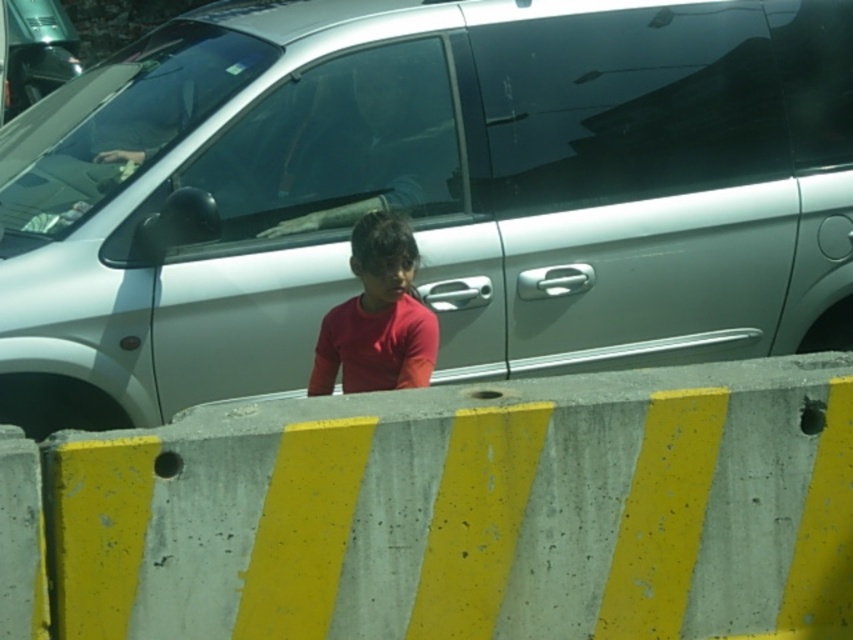
Is silver metallic car at center below concrete/yellow striped barrier at center?

No, silver metallic car at center is not below concrete/yellow striped barrier at center.

Is point (396, 86) farther from viewer compared to point (817, 540)?

That is True.

This screenshot has width=853, height=640. What do you see at coordinates (426, 193) in the screenshot? I see `silver metallic car at center` at bounding box center [426, 193].

Identify the location of silver metallic car at center. The width and height of the screenshot is (853, 640). (426, 193).

Image resolution: width=853 pixels, height=640 pixels. What do you see at coordinates (450, 513) in the screenshot? I see `concrete/yellow striped barrier at center` at bounding box center [450, 513].

In the scene shown: How much distance is there between concrete/yellow striped barrier at center and red matte shirt at center?

1.07 meters

Describe the element at coordinates (450, 513) in the screenshot. I see `concrete/yellow striped barrier at center` at that location.

Locate an element on the screen. The height and width of the screenshot is (640, 853). concrete/yellow striped barrier at center is located at coordinates (450, 513).

Who is positioned more to the left, silver metallic car at center or red matte shirt at center?

Positioned to the left is red matte shirt at center.

Can you confirm if silver metallic car at center is positioned below red matte shirt at center?

No.

Does point (643, 84) lie in front of point (430, 372)?

No, (643, 84) is further to viewer.

Find the location of a particular element. Image resolution: width=853 pixels, height=640 pixels. silver metallic car at center is located at coordinates (426, 193).